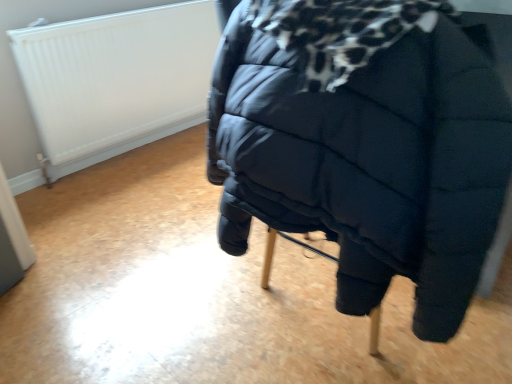
Question: Is point (91, 92) positioned closer to the camera than point (410, 266)?

Choices:
 (A) closer
 (B) farther

Answer: (B)

Question: Which is correct: white textured radiator at upper left is inside black quilted bed at center, or outside of it?

Choices:
 (A) outside
 (B) inside

Answer: (A)

Question: From a real-world perspective, is white textured radiator at upper left positioned above or below black quilted bed at center?

Choices:
 (A) above
 (B) below

Answer: (B)

Question: From the image's perspective, is black quilted bed at center positioned above or below white textured radiator at upper left?

Choices:
 (A) below
 (B) above

Answer: (A)

Question: Would you say black quilted bed at center is inside or outside white textured radiator at upper left?

Choices:
 (A) inside
 (B) outside

Answer: (B)

Question: From a real-world perspective, is black quilted bed at center above or below white textured radiator at upper left?

Choices:
 (A) below
 (B) above

Answer: (B)

Question: In terms of height, does black quilted bed at center look taller or shorter compared to white textured radiator at upper left?

Choices:
 (A) tall
 (B) short

Answer: (B)